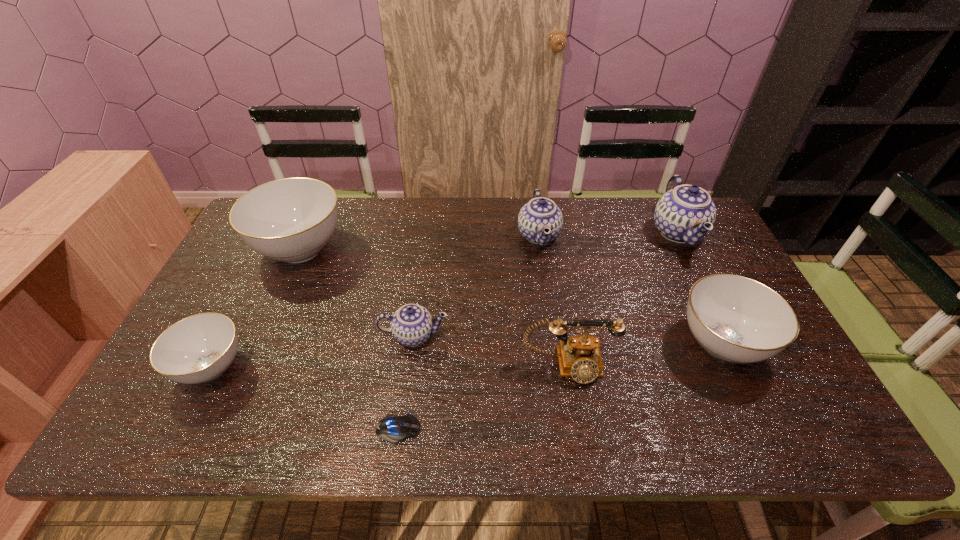
Image resolution: width=960 pixels, height=540 pixels. In order to click on chinaware that is the fifth closest to the farthest gray chinaware in this screenshot , I will do `click(685, 214)`.

This screenshot has height=540, width=960. In order to click on blue chinaware that can be found as the second closest to the smallest blue chinaware in this screenshot , I will do `click(685, 214)`.

Identify which blue chinaware is the closest to the rightmost gray chinaware. Please provide its 2D coordinates. Your answer should be formatted as a tuple, i.e. [(x, y)], where the tuple contains the x and y coordinates of a point satisfying the conditions above.

[(685, 214)]

Locate which gray chinaware is the second closest to the nearest blue chinaware. Please provide its 2D coordinates. Your answer should be formatted as a tuple, i.e. [(x, y)], where the tuple contains the x and y coordinates of a point satisfying the conditions above.

[(199, 348)]

Identify which gray chinaware is located as the second nearest to the farthest gray chinaware. Please provide its 2D coordinates. Your answer should be formatted as a tuple, i.e. [(x, y)], where the tuple contains the x and y coordinates of a point satisfying the conditions above.

[(734, 318)]

In order to click on vacant space that satisfies the following two spatial constraints: 1. at the spout of the fourth chinaware from left to right; 2. on the back side of the rightmost gray chinaware in this screenshot , I will do `click(555, 343)`.

I want to click on vacant point that satisfies the following two spatial constraints: 1. at the spout of the biggest blue chinaware; 2. at the spout of the fourth chinaware from right to left, so tap(729, 335).

Where is `free space that satisfies the following two spatial constraints: 1. on the back side of the smallest gray chinaware; 2. on the left side of the rightmost gray chinaware`? The width and height of the screenshot is (960, 540). free space that satisfies the following two spatial constraints: 1. on the back side of the smallest gray chinaware; 2. on the left side of the rightmost gray chinaware is located at coordinates pyautogui.click(x=224, y=343).

Find the location of a particular element. Image resolution: width=960 pixels, height=540 pixels. free spot that satisfies the following two spatial constraints: 1. at the spout of the rightmost blue chinaware; 2. on the dial number of the telephone is located at coordinates (744, 366).